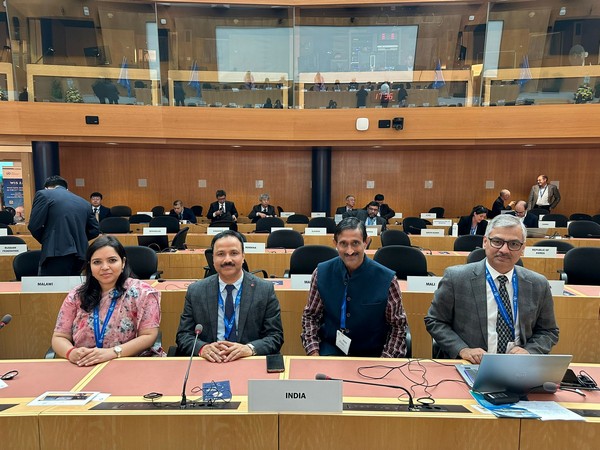
Where is `laptop`? The width and height of the screenshot is (600, 450). laptop is located at coordinates (514, 365).